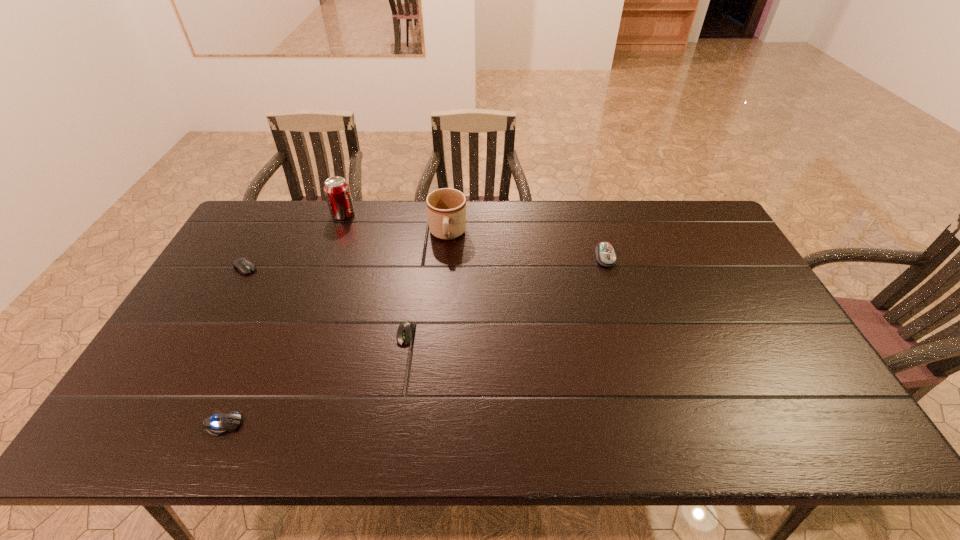
Where is `vacant space situated 0.360m on the side of the mug with the handle`? vacant space situated 0.360m on the side of the mug with the handle is located at coordinates (439, 339).

You are a GUI agent. You are given a task and a screenshot of the screen. Output one action in this format:
    pyautogui.click(x=<x>, y=<y>)
    Task: Click on the vacant space situated on the wheel side of the fourth shortest object
    
    Given the screenshot: What is the action you would take?
    pyautogui.click(x=635, y=354)

Identify the location of vacant region located 0.300m on the front of the leftmost object. (195, 356).

Locate an element on the screen. The height and width of the screenshot is (540, 960). vacant point located 0.210m on the wheel side of the second computer mouse from right to left is located at coordinates (392, 420).

The height and width of the screenshot is (540, 960). I want to click on free location located on the button side of the second computer mouse from left to right, so click(x=378, y=424).

At what (x,y) coordinates should I click in order to perform the action: click on soda can that is at the far edge. Please return your answer as a coordinate pair (x, y). Looking at the image, I should click on (337, 191).

This screenshot has width=960, height=540. Find the location of `mug present at the far edge`. mug present at the far edge is located at coordinates (446, 208).

Where is `object at the near edge`? object at the near edge is located at coordinates (220, 423).

You are a GUI agent. You are given a task and a screenshot of the screen. Output one action in this format:
    pyautogui.click(x=<x>, y=<y>)
    Task: Click on the object that is at the left edge
    
    Given the screenshot: What is the action you would take?
    pyautogui.click(x=243, y=265)

This screenshot has height=540, width=960. In the image, there is a desktop. In order to click on blank space at the far edge in this screenshot , I will do `click(397, 213)`.